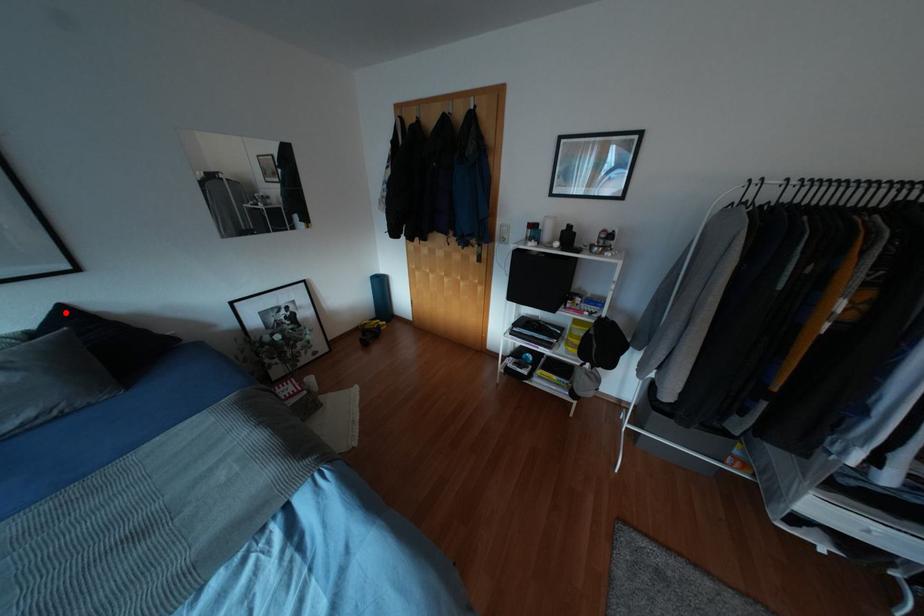
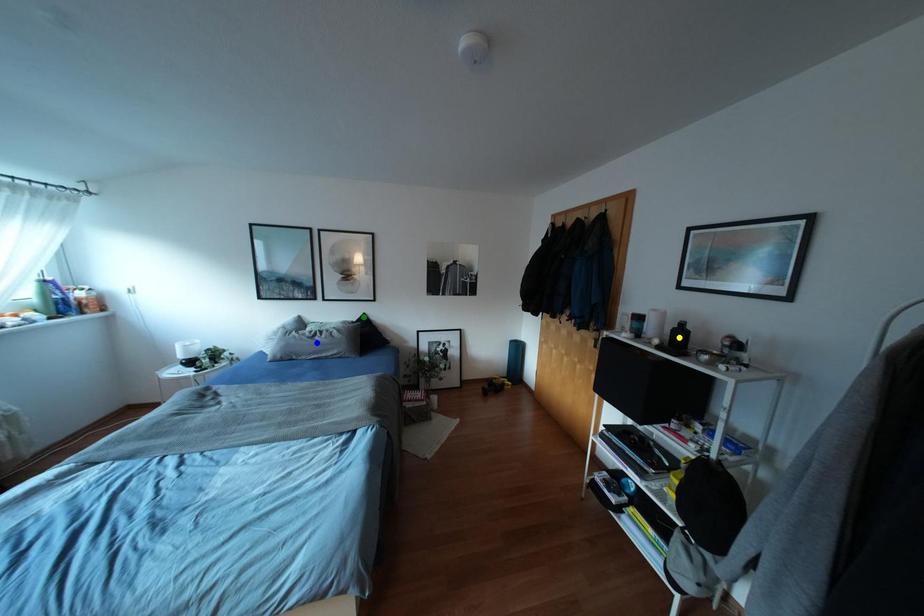
Question: I am providing you with two images of the same scene from different viewpoints. A red point is marked on the first image. You are given multiple points on the second image. In image 2, which mark is for the same physical point as the one in image 1?

Choices:
 (A) blue point
 (B) green point
 (C) yellow point

Answer: (B)